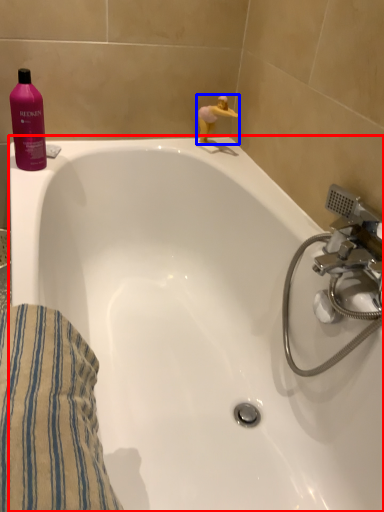
Question: Which object is closer to the camera taking this photo, bathtub (highlighted by a red box) or miniature (highlighted by a blue box)?

Choices:
 (A) bathtub
 (B) miniature

Answer: (A)